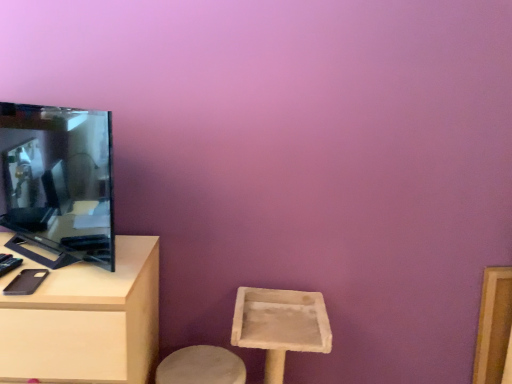
Locate an element on the screen. The width and height of the screenshot is (512, 384). free area below matte black tv at left (from a real-world perspective) is located at coordinates (52, 252).